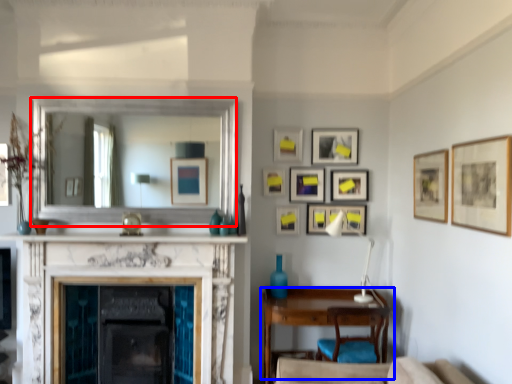
Question: Which object is further to the camera taking this photo, mirror (highlighted by a red box) or table (highlighted by a blue box)?

Choices:
 (A) mirror
 (B) table

Answer: (A)